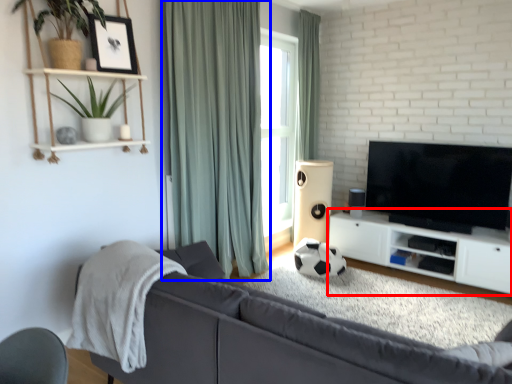
Question: Which point is closer to the camera, cabinetry (highlighted by a red box) or curtain (highlighted by a blue box)?

Choices:
 (A) cabinetry
 (B) curtain

Answer: (B)